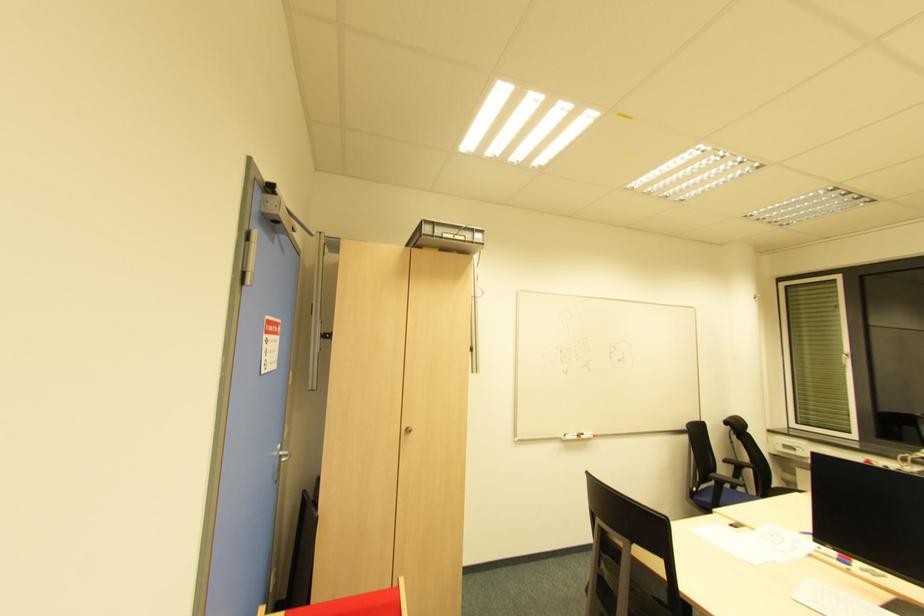
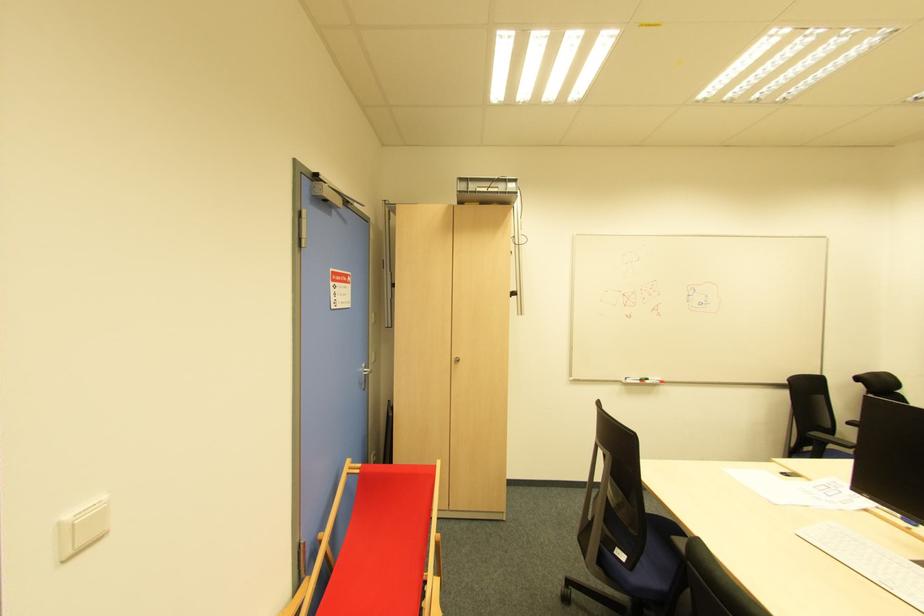
In the second image, find the point that corresponds to point (408, 432) in the first image.

(457, 362)